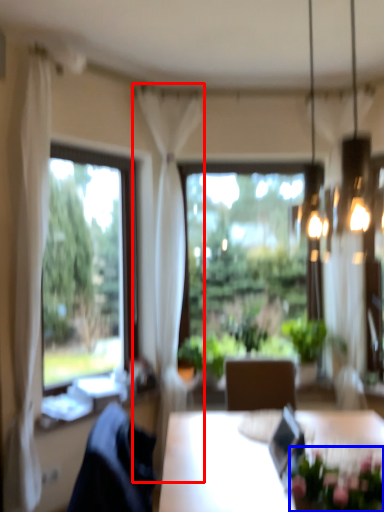
Question: Which object appears farthest to the camera in this image, curtain (highlighted by a red box) or floral arrangement (highlighted by a blue box)?

Choices:
 (A) curtain
 (B) floral arrangement

Answer: (A)